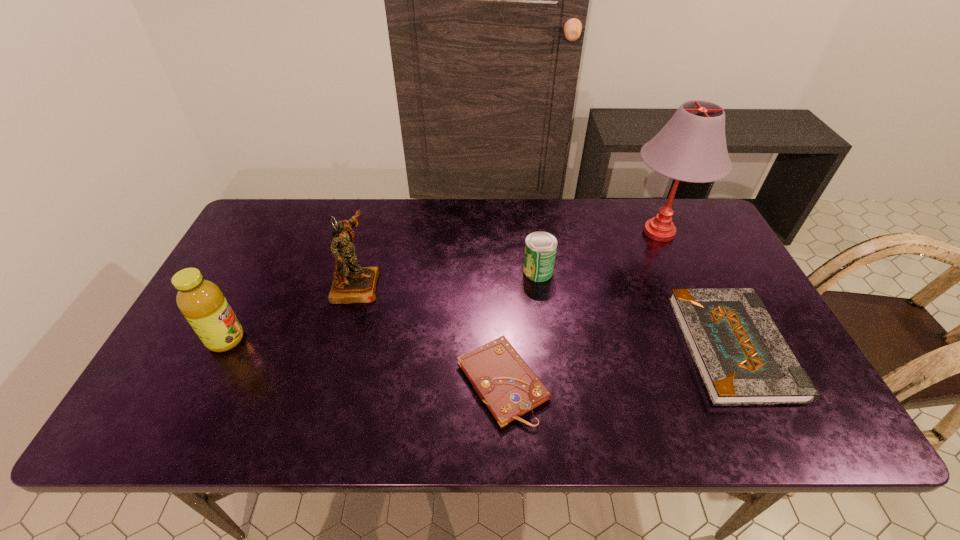
You are a GUI agent. You are given a task and a screenshot of the screen. Output one action in this format:
    pyautogui.click(x=<x>, y=<y>)
    Task: Click on the tallest object
    The height and width of the screenshot is (540, 960).
    Given the screenshot: What is the action you would take?
    pyautogui.click(x=691, y=147)

Locate an element on the screen. table lamp is located at coordinates (691, 147).

Locate an element on the screen. The image size is (960, 540). the fifth object from right to left is located at coordinates (352, 283).

Locate an element on the screen. The image size is (960, 540). the leftmost object is located at coordinates (201, 301).

Locate an element on the screen. This screenshot has height=540, width=960. can is located at coordinates (540, 247).

I want to click on the taller notebook, so click(742, 358).

The height and width of the screenshot is (540, 960). Identify the location of the second shortest object. (742, 358).

I want to click on the left notebook, so click(505, 383).

Find the location of a particular element. the shortest object is located at coordinates (505, 383).

Locate an element on the screen. blank area located on the front-facing side of the tallest object is located at coordinates (577, 232).